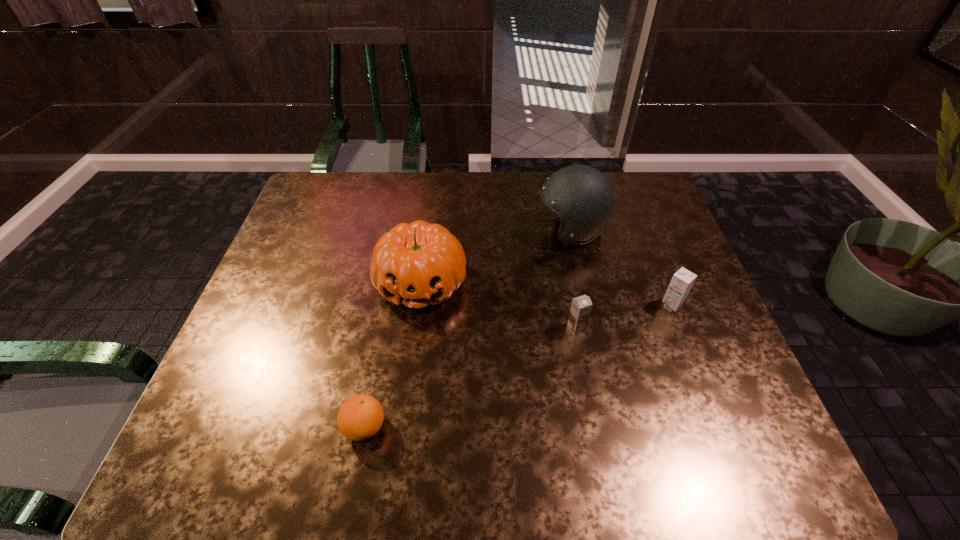
Identify the location of the tallest object. This screenshot has width=960, height=540. (582, 196).

Find the location of a particular element. the fourth shortest object is located at coordinates (417, 264).

This screenshot has width=960, height=540. I want to click on the right chocolate milk, so click(682, 281).

Locate an element on the screen. Image resolution: width=960 pixels, height=540 pixels. the farther chocolate milk is located at coordinates (682, 281).

Locate an element on the screen. the nearer chocolate milk is located at coordinates (581, 306).

Image resolution: width=960 pixels, height=540 pixels. Identify the location of the left chocolate milk. (581, 306).

Where is `orange`? Image resolution: width=960 pixels, height=540 pixels. orange is located at coordinates (360, 417).

Where is `the shortest object`? The height and width of the screenshot is (540, 960). the shortest object is located at coordinates (360, 417).

Where is `free location located at the face opening of the tallest object`? free location located at the face opening of the tallest object is located at coordinates (474, 230).

This screenshot has width=960, height=540. In order to click on vacant point located 0.160m at the face opening of the tallest object in this screenshot , I will do `click(481, 230)`.